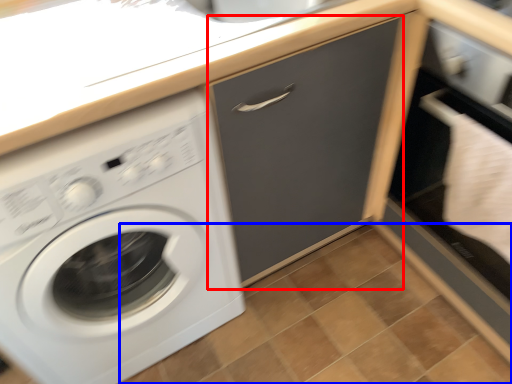
Question: Which object is closer to the camera taking this photo, drawer (highlighted by a red box) or tile (highlighted by a blue box)?

Choices:
 (A) drawer
 (B) tile

Answer: (A)